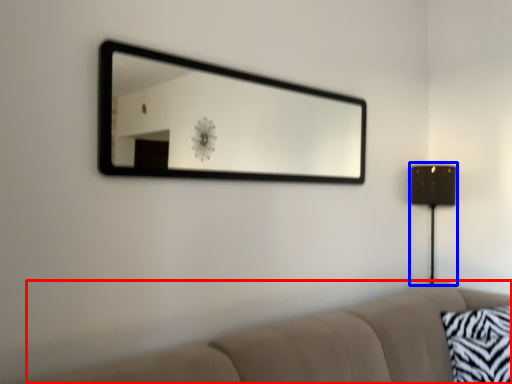
Question: Which object appears farthest to the camera in this image, studio couch (highlighted by a red box) or table lamp (highlighted by a blue box)?

Choices:
 (A) studio couch
 (B) table lamp

Answer: (B)